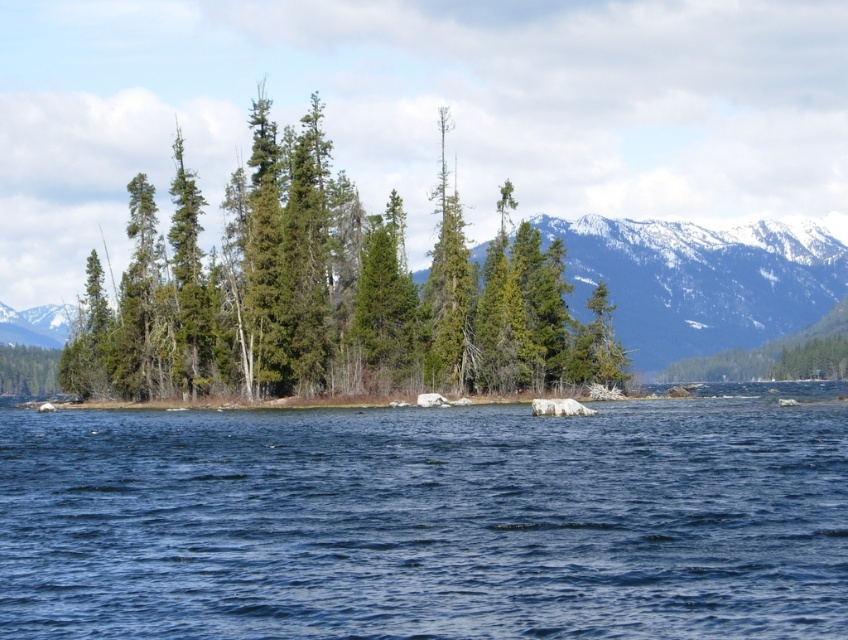
Can you confirm if green matte trees at center is positioned above snowy rocky mountain at center?

Correct, green matte trees at center is located above snowy rocky mountain at center.

Consider the image. Can you confirm if green matte trees at center is positioned below snowy rocky mountain at center?

No, green matte trees at center is not below snowy rocky mountain at center.

Looking at this image, who is more distant from viewer, (536,257) or (752,333)?

The point (752,333) is more distant.

You are a GUI agent. You are given a task and a screenshot of the screen. Output one action in this format:
    pyautogui.click(x=<x>, y=<y>)
    Task: Click on the green matte trees at center
    
    Given the screenshot: What is the action you would take?
    pyautogui.click(x=324, y=292)

Does blue liquid water at center lie behind green matte trees at center?

That is False.

Which is above, blue liquid water at center or green matte trees at center?

green matte trees at center is above.

Who is more forward, (342, 468) or (113, 381)?

Point (342, 468) is more forward.

This screenshot has height=640, width=848. In order to click on blue liquid water at center in this screenshot , I will do `click(430, 520)`.

Can you confirm if green matte trees at center is positioned to the right of snowy white mountain at left?

Yes, green matte trees at center is to the right of snowy white mountain at left.

Who is positioned more to the left, green matte trees at center or snowy white mountain at left?

snowy white mountain at left is more to the left.

Between point (371, 324) and point (54, 344), which one is positioned in front?

Point (371, 324) is in front.

This screenshot has height=640, width=848. In order to click on green matte trees at center in this screenshot , I will do `click(324, 292)`.